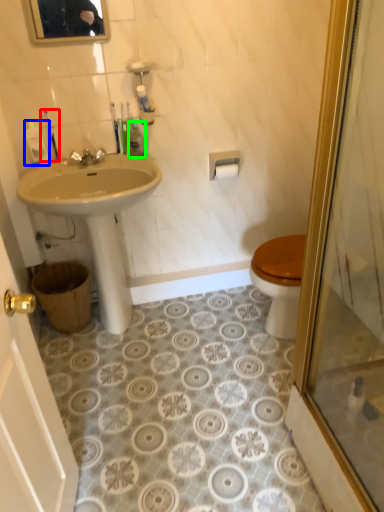
Question: Estimate the real-world distances between objects in this image. Which object is farther from toiletry (highlighted by a red box), toiletry (highlighted by a blue box) or toiletry (highlighted by a green box)?

Choices:
 (A) toiletry
 (B) toiletry

Answer: (B)